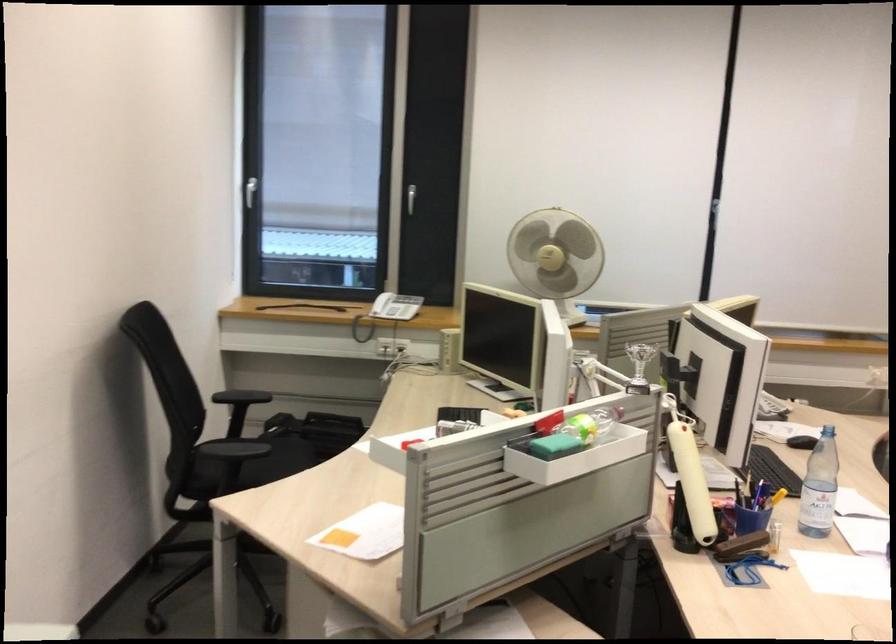
Find where to lift the small silver trophy. Please return your answer as a coordinate pair (x, y).

(640, 366)